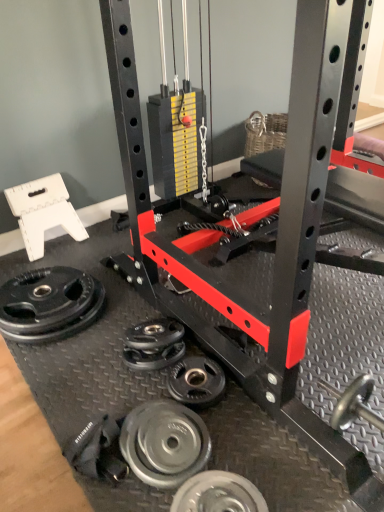
Question: Considering the positions of point (218, 498) and point (216, 394), is point (218, 498) closer or farther from the camera than point (216, 394)?

Choices:
 (A) farther
 (B) closer

Answer: (B)

Question: In terms of height, does silver metallic weight plate at lower center, the fourth wheel in the top-to-bottom sequence, look taller or shorter compared to silver metallic weight plate at lower center, which ranks as the 2th wheel in back-to-front order?

Choices:
 (A) short
 (B) tall

Answer: (B)

Question: Considering the real-world distances, which object is farthest from the black rubber weight plate at lower left, which ranks as the 4th wheel in bottom-to-top order?

Choices:
 (A) silver metallic weight plate at lower center, which appears as the 4th wheel when viewed from the back
 (B) silver metallic weight plate at lower center, marked as the third wheel in a bottom-to-top arrangement
 (C) silver metallic weight plate at lower center, the second wheel from the bottom

Answer: (A)

Question: Estimate the real-world distances between objects in this image. Which object is closer to the silver metallic weight plate at lower center, marked as the 1th wheel in a bottom-to-top arrangement?

Choices:
 (A) silver metallic weight plate at lower center, the third wheel in the front-to-back sequence
 (B) silver metallic weight plate at lower center, the second wheel from the bottom
 (C) black rubber weight plate at lower left, which is the first wheel in back-to-front order

Answer: (B)